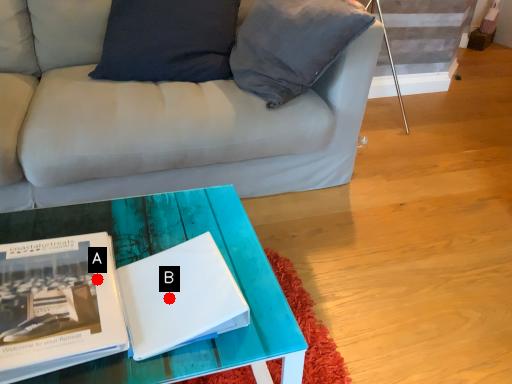
Question: Two points are circled on the image, labeled by A and B beside each circle. Which point is farther to the camera?

Choices:
 (A) A is further
 (B) B is further

Answer: (A)